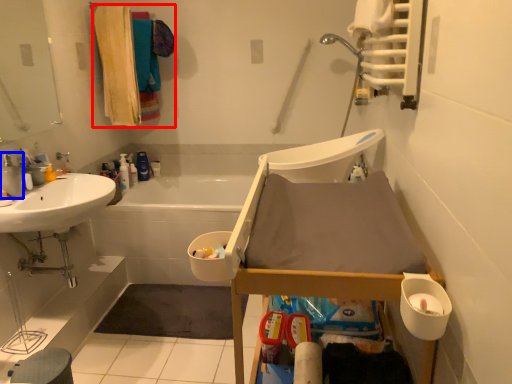
Question: Which point is further to the camera, laundry (highlighted by a red box) or tap (highlighted by a blue box)?

Choices:
 (A) laundry
 (B) tap

Answer: (A)